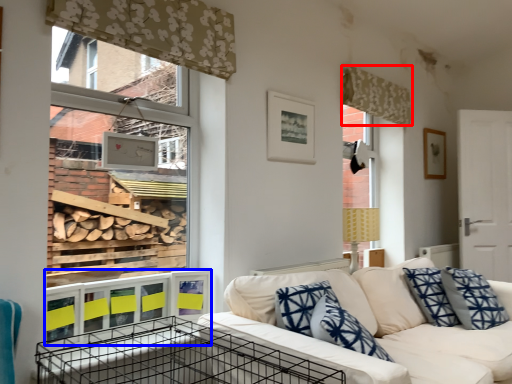
Question: Which point is closer to the camera, curtain (highlighted by a red box) or window sill (highlighted by a blue box)?

Choices:
 (A) curtain
 (B) window sill

Answer: (B)